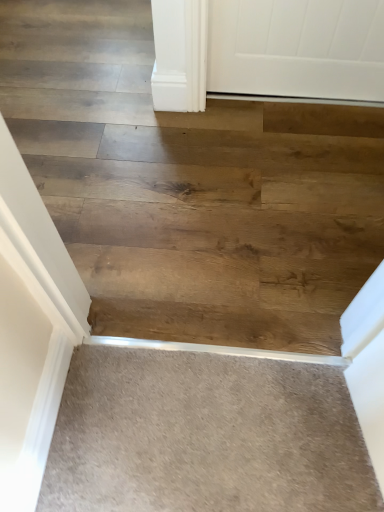
The width and height of the screenshot is (384, 512). What do you see at coordinates (212, 228) in the screenshot? I see `wooden stairs at center` at bounding box center [212, 228].

At what (x,y) coordinates should I click in order to perform the action: click on wooden stairs at center. Please return your answer as a coordinate pair (x, y). Image resolution: width=384 pixels, height=512 pixels. Looking at the image, I should click on (212, 228).

Where is `wooden stairs at center`? This screenshot has height=512, width=384. wooden stairs at center is located at coordinates (212, 228).